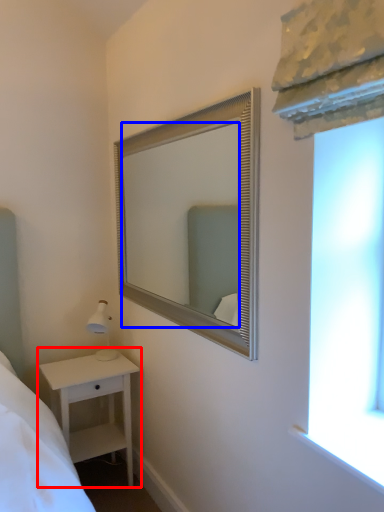
Question: Among these objects, which one is nearest to the camera, nightstand (highlighted by a red box) or mirror (highlighted by a blue box)?

Choices:
 (A) nightstand
 (B) mirror

Answer: (B)